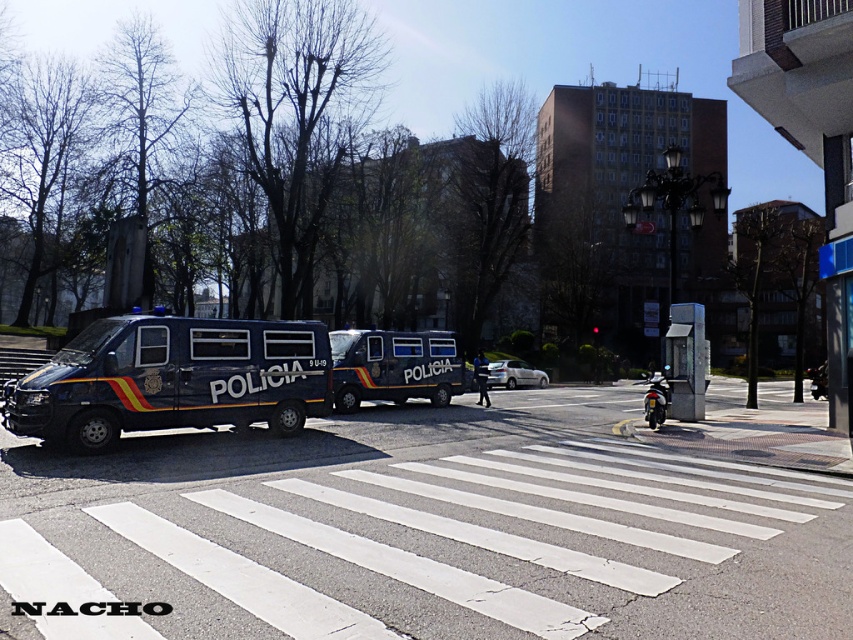
You are a delivery driver who needs to park your 2.5m tall truck in this street scene. Looking at the polished blue van at center and the shiny chrome motorcycle at right, which vehicle should you use as a reference for height restrictions? Explain your choice based on their sizes.

The polished blue van at center is not as tall as the shiny chrome motorcycle at right, so you should use the shiny chrome motorcycle at right as a reference since it is taller and more likely to indicate the maximum height allowed for vehicles in this area.

Consider the image. You are a pedestrian standing at the pedestrian crossing. You see the metallic blue van at left and the white matte car at center. Which vehicle is nearer to you?

The metallic blue van at left is closer to the viewer than the white matte car at center, so the metallic blue van at left is nearer to you.